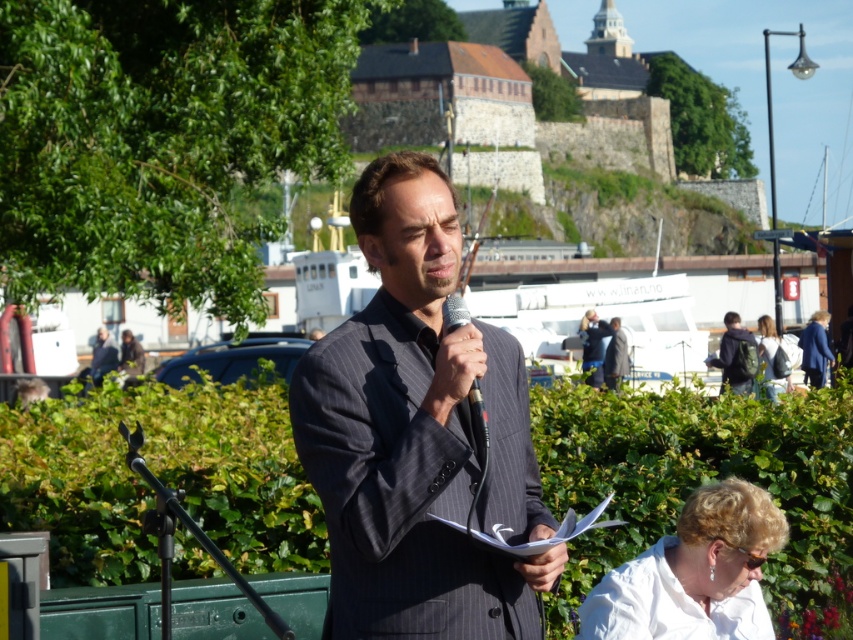
Question: Which object is positioned closest to the dark gray pinstripe suit at center?

Choices:
 (A) dark blue suit at center
 (B) dark green backpack at right

Answer: (B)

Question: Which object is positioned closest to the dark blue suit at center?

Choices:
 (A) dark gray suit at center
 (B) metallic silver microphone at center
 (C) dark gray pinstripe suit at center

Answer: (A)

Question: Where is white fabric at lower right located in relation to metallic silver microphone at center in the image?

Choices:
 (A) right
 (B) left

Answer: (A)

Question: Which point is farther from the camera taking this photo?

Choices:
 (A) (618, 608)
 (B) (589, 352)
 (C) (480, 396)

Answer: (B)

Question: Where is dark gray pinstripe suit at center located in relation to metallic silver microphone at center in the image?

Choices:
 (A) right
 (B) left

Answer: (B)

Question: Observing the image, what is the correct spatial positioning of dark gray pinstripe suit at center in reference to white fabric at lower right?

Choices:
 (A) below
 (B) above

Answer: (B)